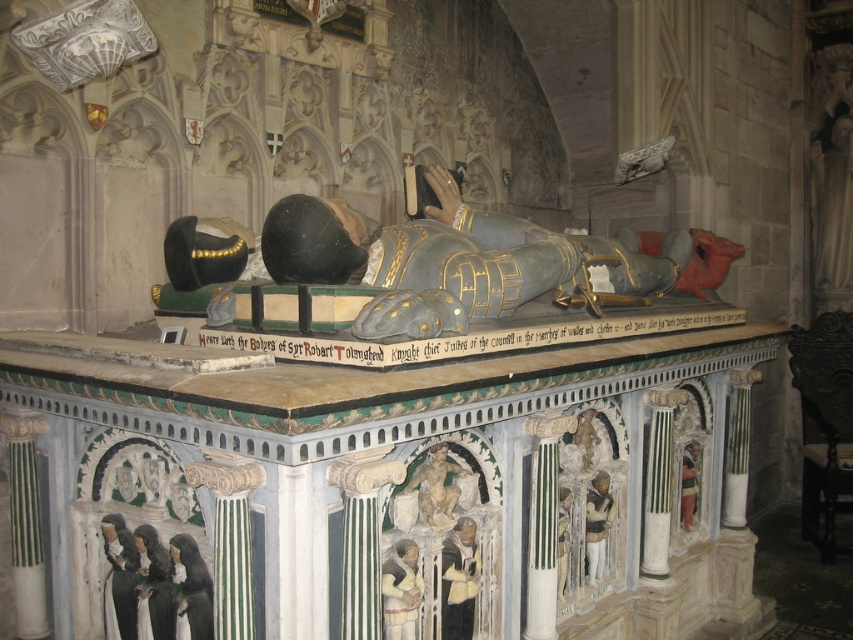
You are an art conservator examining the tomb monument. You notice a specific point of interest at coordinates point (451, 266). What object is located at this point?

The point (451, 266) corresponds to the polished silver armor at center.

You are an archaeologist examining the tomb monument. You need to locate the polished silver armor at center. According to the coordinates provided, where exactly is it positioned on the monument?

The polished silver armor at center is positioned at coordinates point (x=451, y=266).